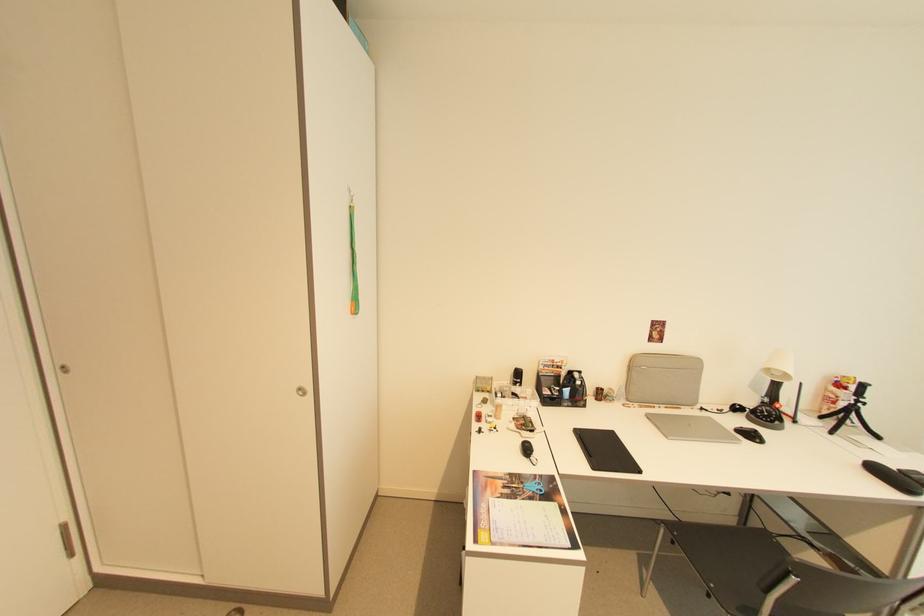
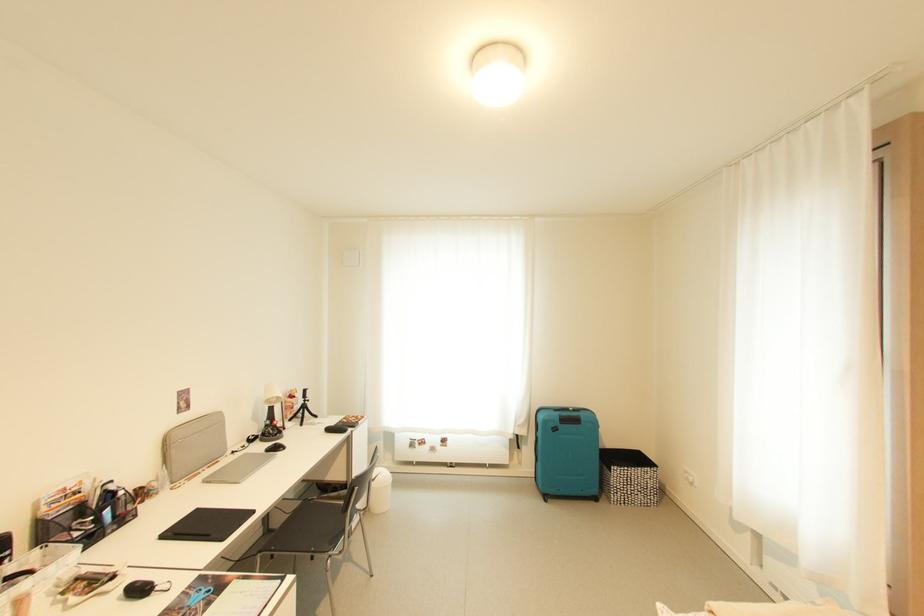
Question: Based on the continuous images, in which direction is the camera rotating? Reply with the corresponding letter.

Choices:
 (A) Left
 (B) Right
 (C) Up
 (D) Down

Answer: (B)